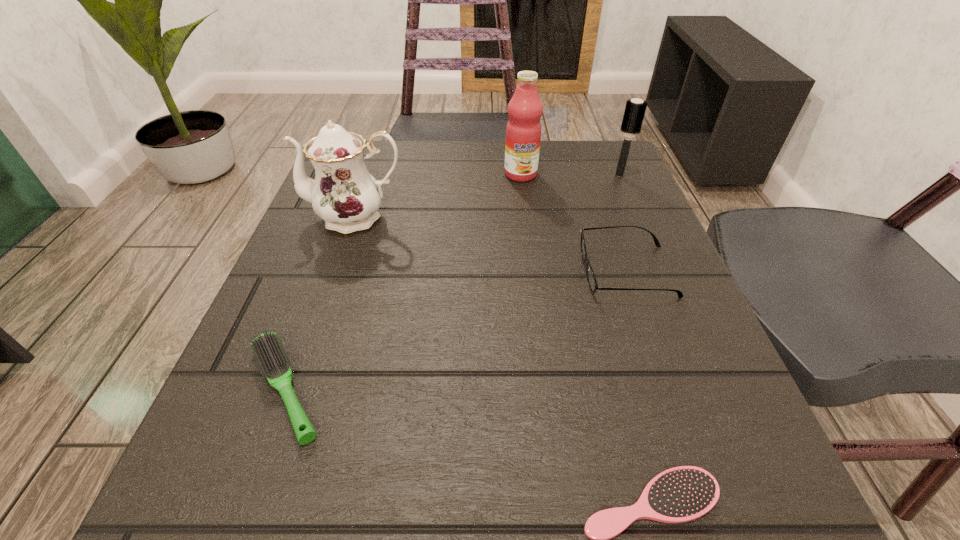
I want to click on free region located 0.340m on the front-facing side of the spectacles, so click(x=375, y=271).

I want to click on free space located 0.140m on the front-facing side of the spectacles, so click(497, 271).

In order to click on vacant region located 0.230m on the front-facing side of the spectacles in this screenshot , I will do `click(443, 271)`.

Locate an element on the screen. The height and width of the screenshot is (540, 960). free location located on the right of the second farthest hairbrush is located at coordinates (456, 388).

You are a GUI agent. You are given a task and a screenshot of the screen. Output one action in this format:
    pyautogui.click(x=<x>, y=<y>)
    Task: Click on the fruit juice that is at the far edge
    
    Given the screenshot: What is the action you would take?
    pyautogui.click(x=523, y=131)

This screenshot has width=960, height=540. What are the coordinates of `chinaware that is positioned at the far edge` in the screenshot? It's located at (344, 194).

This screenshot has width=960, height=540. In order to click on hairbrush that is at the far edge in this screenshot , I will do `click(635, 109)`.

Where is `chinaware located in the left edge section of the desktop`? Image resolution: width=960 pixels, height=540 pixels. chinaware located in the left edge section of the desktop is located at coordinates (344, 194).

Identify the location of hairbrush at the left edge. The width and height of the screenshot is (960, 540). (267, 348).

What are the coordinates of `hairbrush that is at the right edge` in the screenshot? It's located at (635, 109).